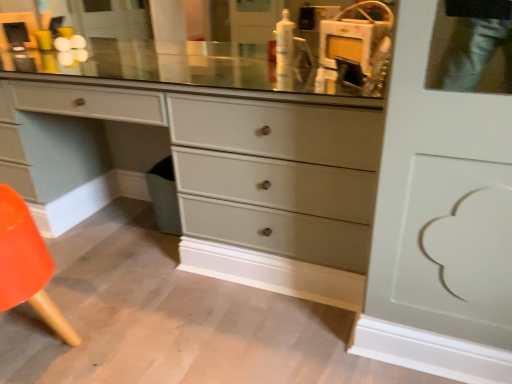
Question: Is white glossy lotion at upper center inside orange plastic chair at lower left?

Choices:
 (A) no
 (B) yes

Answer: (A)

Question: Does orange plastic chair at lower left have a smaller size compared to white glossy lotion at upper center?

Choices:
 (A) no
 (B) yes

Answer: (A)

Question: Can you confirm if orange plastic chair at lower left is thinner than white glossy lotion at upper center?

Choices:
 (A) no
 (B) yes

Answer: (A)

Question: Could you tell me if orange plastic chair at lower left is facing white glossy lotion at upper center?

Choices:
 (A) no
 (B) yes

Answer: (A)

Question: Is orange plastic chair at lower left positioned behind white glossy lotion at upper center?

Choices:
 (A) no
 (B) yes

Answer: (A)

Question: From the image's perspective, does orange plastic chair at lower left appear lower than white glossy lotion at upper center?

Choices:
 (A) yes
 (B) no

Answer: (A)

Question: Are white glossy lotion at upper center and matte gray dresser at center far apart?

Choices:
 (A) yes
 (B) no

Answer: (B)

Question: Does white glossy lotion at upper center have a greater width compared to matte gray dresser at center?

Choices:
 (A) no
 (B) yes

Answer: (A)

Question: Could you tell me if white glossy lotion at upper center is facing matte gray dresser at center?

Choices:
 (A) no
 (B) yes

Answer: (A)

Question: Considering the relative sizes of white glossy lotion at upper center and matte gray dresser at center in the image provided, is white glossy lotion at upper center taller than matte gray dresser at center?

Choices:
 (A) no
 (B) yes

Answer: (A)

Question: Does white glossy lotion at upper center appear on the right side of matte gray dresser at center?

Choices:
 (A) no
 (B) yes

Answer: (B)

Question: From the image's perspective, would you say white glossy lotion at upper center is shown under matte gray dresser at center?

Choices:
 (A) yes
 (B) no

Answer: (B)

Question: Would you say matte gray dresser at center is a long distance from white glossy lotion at upper center?

Choices:
 (A) no
 (B) yes

Answer: (A)